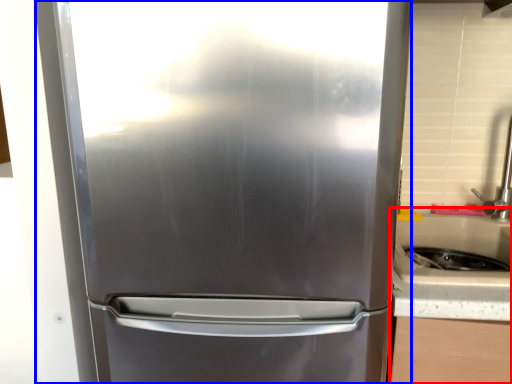
Question: Which object is closer to the camera taking this photo, counter top (highlighted by a red box) or refrigerator (highlighted by a blue box)?

Choices:
 (A) counter top
 (B) refrigerator

Answer: (B)